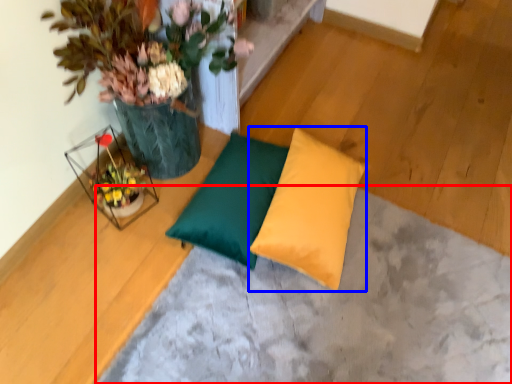
Question: Which of the following is the closest to the observer, concrete (highlighted by a red box) or pillow (highlighted by a blue box)?

Choices:
 (A) concrete
 (B) pillow

Answer: (A)